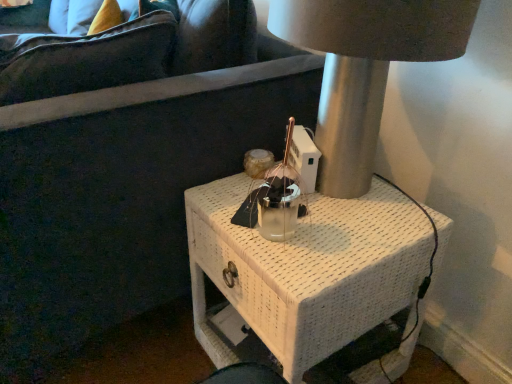
Identify the location of vacant space in metallic silver lamp at center (from a real-world perspective). The width and height of the screenshot is (512, 384). (352, 202).